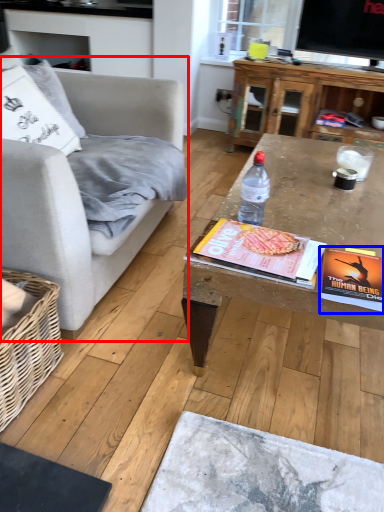
Question: Among these objects, which one is nearest to the camera, studio couch (highlighted by a red box) or paperback book (highlighted by a blue box)?

Choices:
 (A) studio couch
 (B) paperback book

Answer: (A)